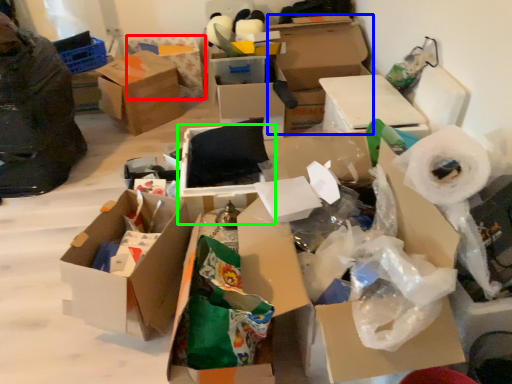
Question: Which object is the closest to the box (highlighted by a red box)? Choose among these: box (highlighted by a blue box) or box (highlighted by a green box).

Choices:
 (A) box
 (B) box

Answer: (A)